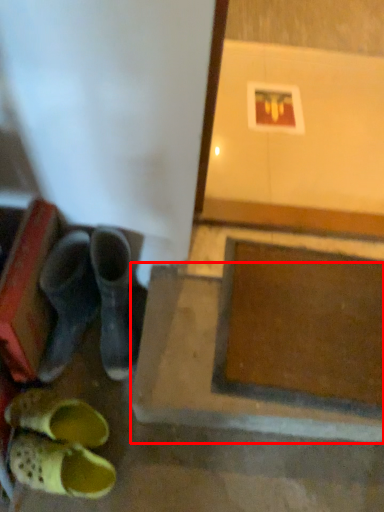
Question: Where is concrete (annotated by the red box) located in relation to footwear in the image?

Choices:
 (A) right
 (B) left

Answer: (A)